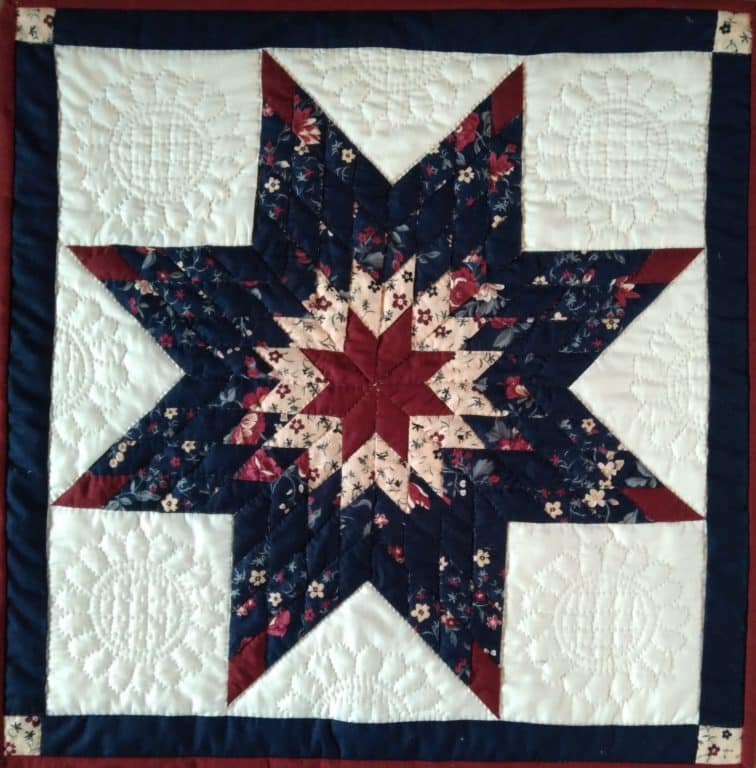
The image size is (756, 768). In order to click on corner in this screenshot , I will do `click(748, 32)`.